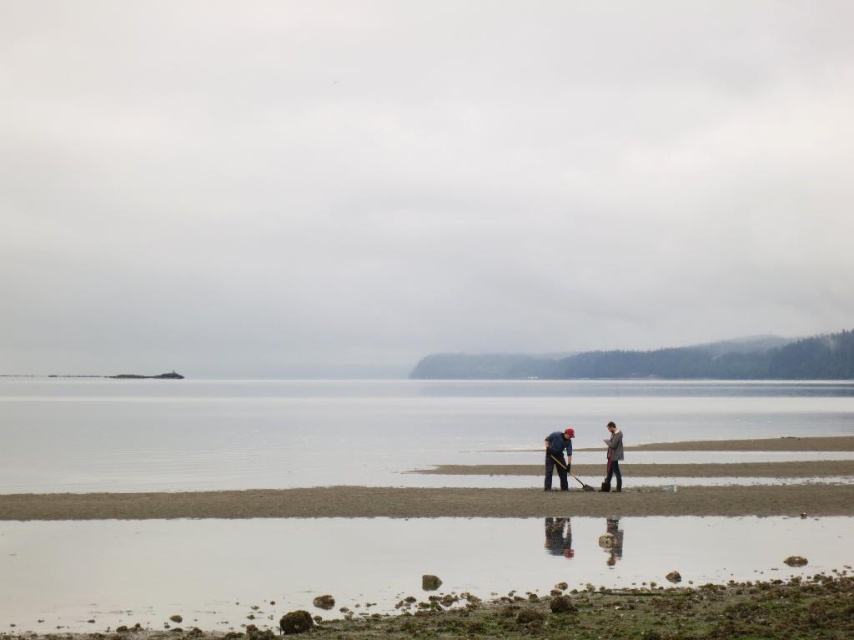
Question: Based on their relative distances, which object is nearer to the clear water at center?

Choices:
 (A) blue fabric jacket at center
 (B) blue fabric shirt at center

Answer: (B)

Question: Is clear water at center wider than blue fabric jacket at center?

Choices:
 (A) yes
 (B) no

Answer: (A)

Question: Which is farther from the gray wool sweater at center?

Choices:
 (A) blue fabric jacket at center
 (B) blue fabric shirt at center
 (C) clear water at center

Answer: (C)

Question: Which point appears closest to the camera in this image?

Choices:
 (A) (613, 442)
 (B) (238, 435)
 (C) (566, 444)
 (D) (545, 460)

Answer: (D)

Question: Can you confirm if clear water at center is positioned to the right of blue fabric shirt at center?

Choices:
 (A) no
 (B) yes

Answer: (A)

Question: Does clear water at center appear on the left side of blue fabric jacket at center?

Choices:
 (A) yes
 (B) no

Answer: (A)